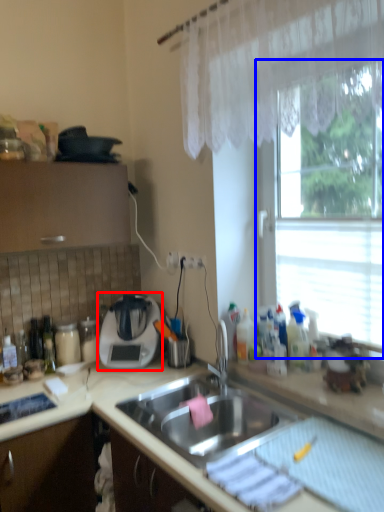
Question: Which of the following is the farthest to the observer, appliance (highlighted by a red box) or window (highlighted by a blue box)?

Choices:
 (A) appliance
 (B) window

Answer: (A)